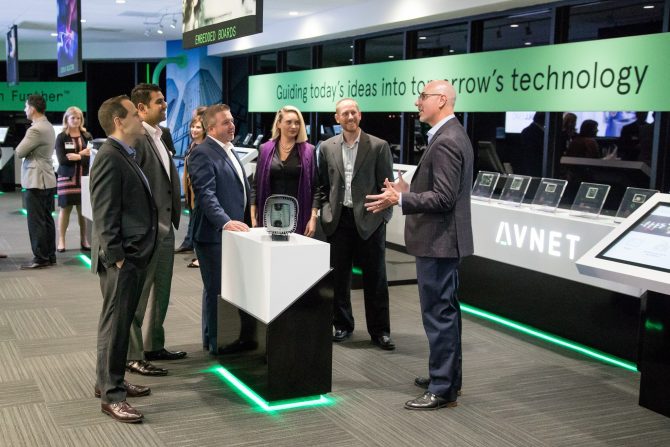
Locate an element on the screen. This screenshot has height=447, width=670. man putting right hand on table is located at coordinates (214, 193).